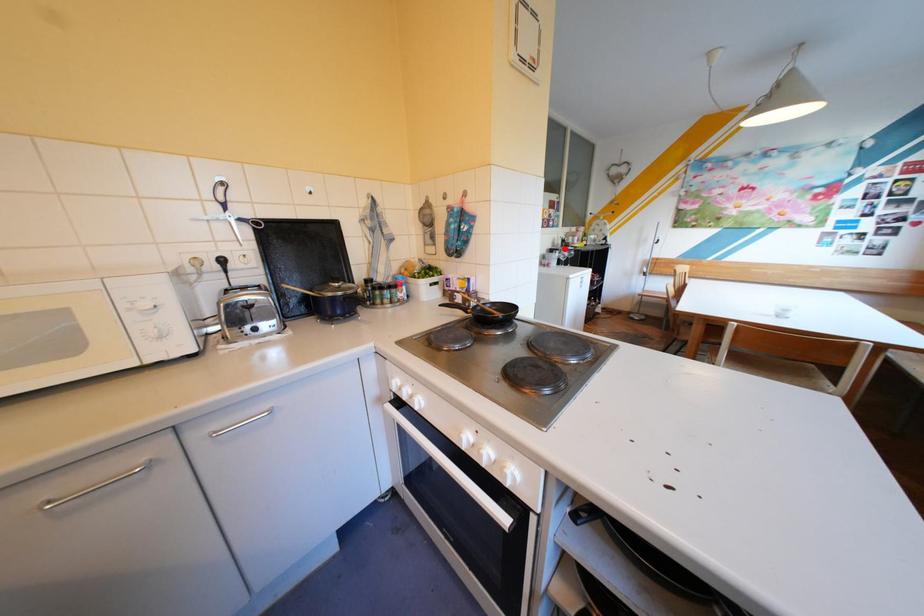
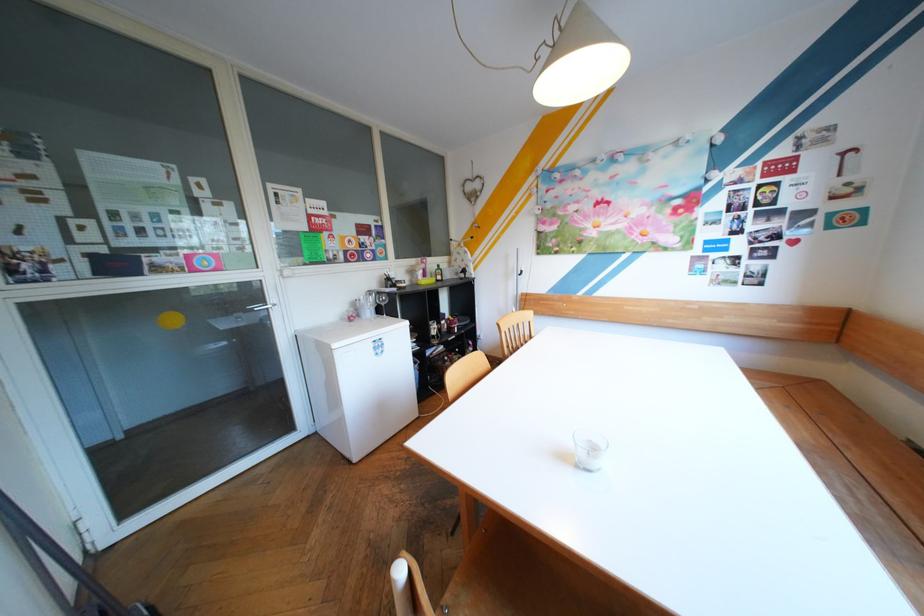
Question: I am providing you with two images of the same scene from different viewpoints. Image1 has a red point marked. In image2, the corresponding 3D location appears at what relative position? Reply with the corresponding letter.

Choices:
 (A) Closer
 (B) Farther

Answer: (B)